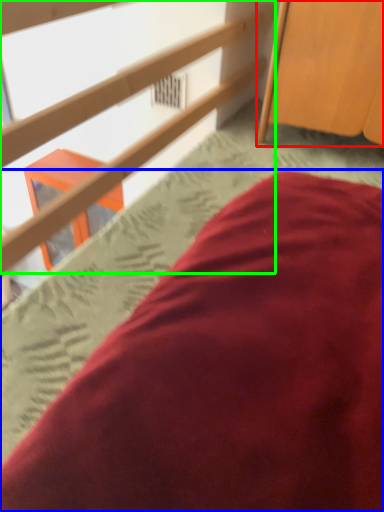
Question: Which is farther away from furniture (highlighted by a red box)? bed (highlighted by a blue box) or rail (highlighted by a green box)?

Choices:
 (A) bed
 (B) rail

Answer: (A)